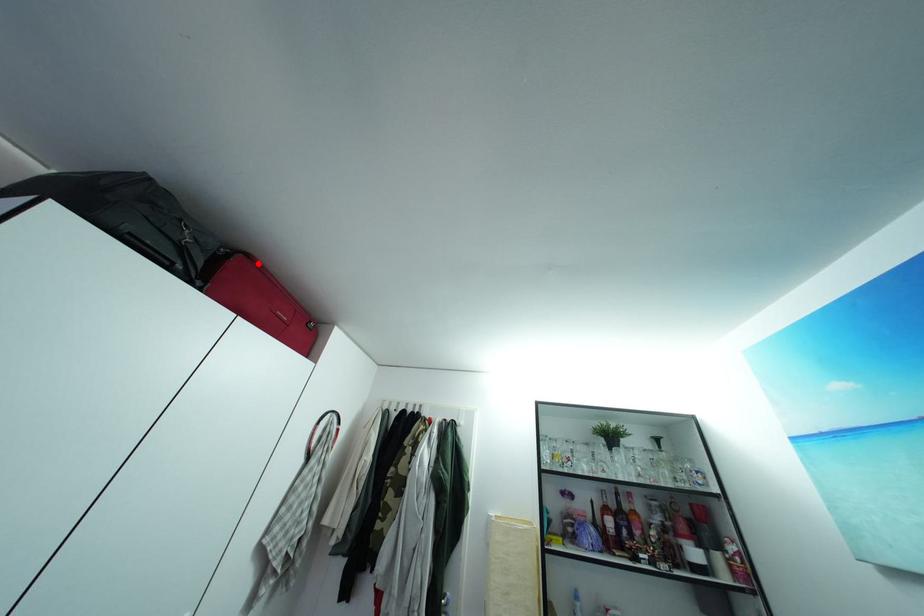
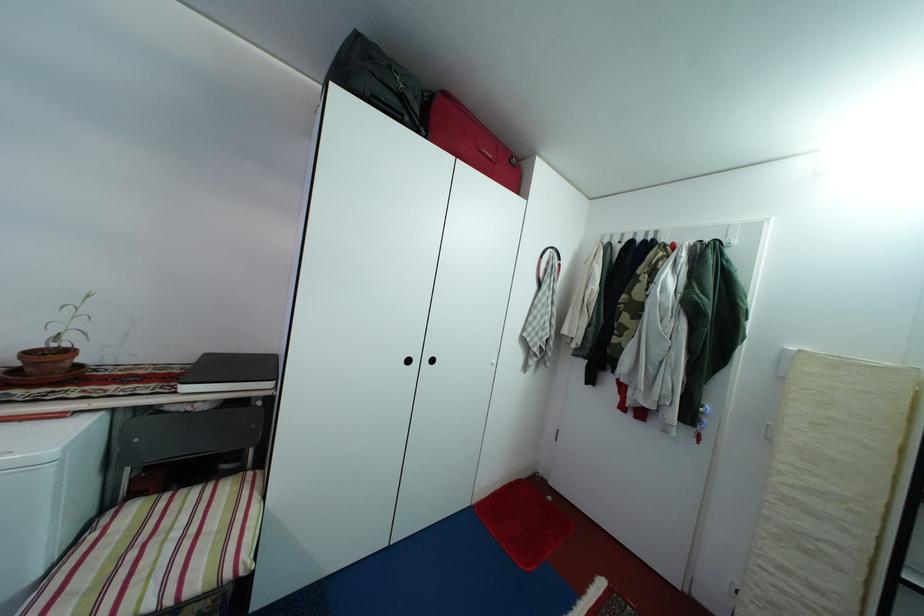
Question: I am providing you with two images of the same scene from different viewpoints. A red point is shown in image1. For the corresponding object point in image2, is it positioned nearer or farther from the camera?

Choices:
 (A) Nearer
 (B) Farther

Answer: (A)